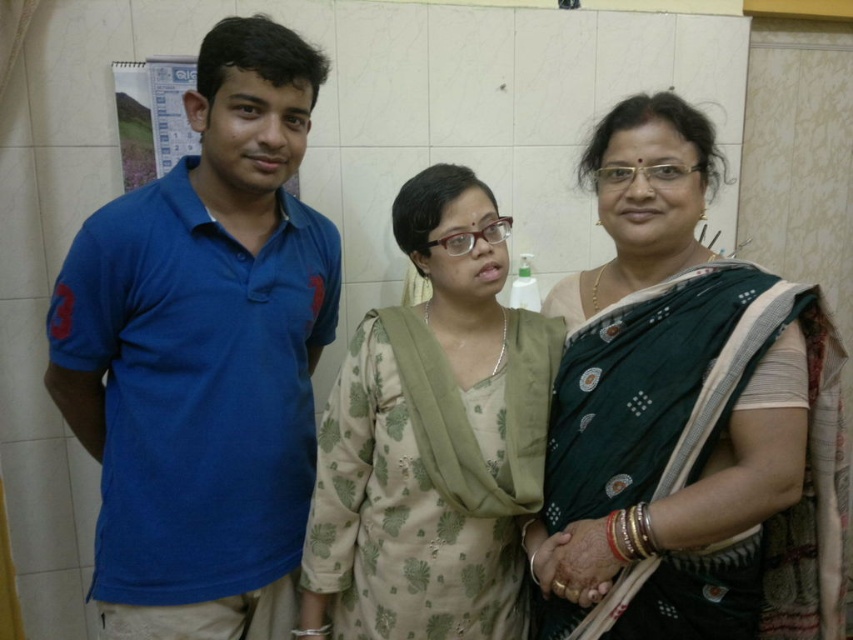
Question: Is green silk saree at center below light beige floral dress at center?

Choices:
 (A) yes
 (B) no

Answer: (B)

Question: Considering the real-world distances, which object is farthest from the green silk saree at center?

Choices:
 (A) blue cotton polo shirt at left
 (B) light beige floral dress at center

Answer: (A)

Question: Observing the image, what is the correct spatial positioning of blue cotton polo shirt at left in reference to green silk saree at center?

Choices:
 (A) above
 (B) below

Answer: (A)

Question: Which object appears farthest from the camera in this image?

Choices:
 (A) light beige floral dress at center
 (B) blue cotton polo shirt at left

Answer: (A)

Question: Can you confirm if green silk saree at center is wider than light beige floral dress at center?

Choices:
 (A) yes
 (B) no

Answer: (A)

Question: Estimate the real-world distances between objects in this image. Which object is closer to the green silk saree at center?

Choices:
 (A) blue cotton polo shirt at left
 (B) light beige floral dress at center

Answer: (B)